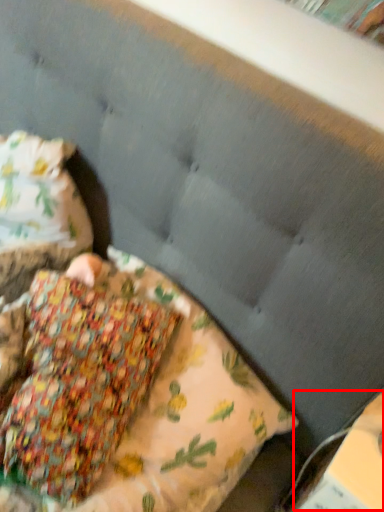
Question: From the image's perspective, what is the correct spatial positioning of paperback book (annotated by the red box) in reference to pillow?

Choices:
 (A) below
 (B) above

Answer: (A)